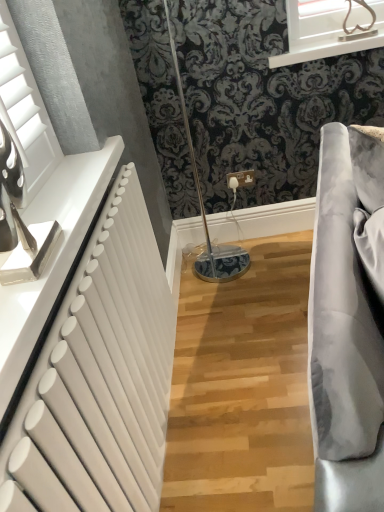
Question: Considering the positions of white matte radiator at left and white glossy frame at upper center in the image, is white matte radiator at left wider or thinner than white glossy frame at upper center?

Choices:
 (A) thin
 (B) wide

Answer: (A)

Question: Does point (79, 382) appear closer or farther from the camera than point (337, 31)?

Choices:
 (A) farther
 (B) closer

Answer: (B)

Question: From the image's perspective, is white matte radiator at left located above or below white glossy frame at upper center?

Choices:
 (A) above
 (B) below

Answer: (B)

Question: Considering the positions of white glossy frame at upper center and white matte radiator at left in the image, is white glossy frame at upper center taller or shorter than white matte radiator at left?

Choices:
 (A) short
 (B) tall

Answer: (A)

Question: From the image's perspective, is white glossy frame at upper center located above or below white matte radiator at left?

Choices:
 (A) above
 (B) below

Answer: (A)

Question: Is white glossy frame at upper center bigger or smaller than white matte radiator at left?

Choices:
 (A) big
 (B) small

Answer: (B)

Question: Considering the positions of white glossy frame at upper center and white matte radiator at left in the image, is white glossy frame at upper center wider or thinner than white matte radiator at left?

Choices:
 (A) thin
 (B) wide

Answer: (B)